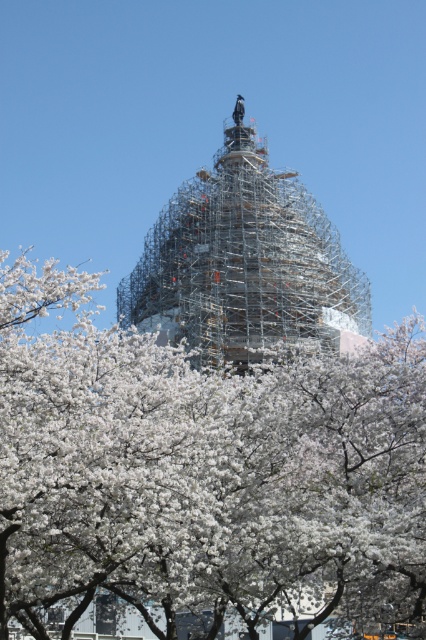
Question: Does white blossoms at center have a greater width compared to scaffolding at center?

Choices:
 (A) yes
 (B) no

Answer: (A)

Question: Which object appears closest to the camera in this image?

Choices:
 (A) scaffolding at center
 (B) white blossoms at center

Answer: (B)

Question: Is white blossoms at center to the left of scaffolding at center from the viewer's perspective?

Choices:
 (A) yes
 (B) no

Answer: (A)

Question: Which point is closer to the camera?

Choices:
 (A) (218, 288)
 (B) (118, 544)

Answer: (B)

Question: Among these objects, which one is farthest from the camera?

Choices:
 (A) white blossoms at center
 (B) scaffolding at center

Answer: (B)

Question: Does white blossoms at center appear over scaffolding at center?

Choices:
 (A) no
 (B) yes

Answer: (A)